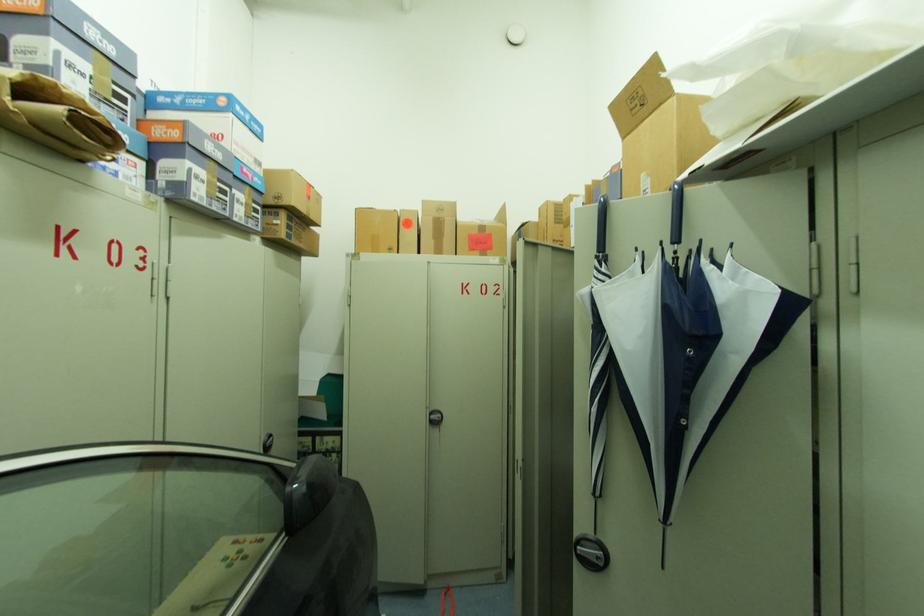
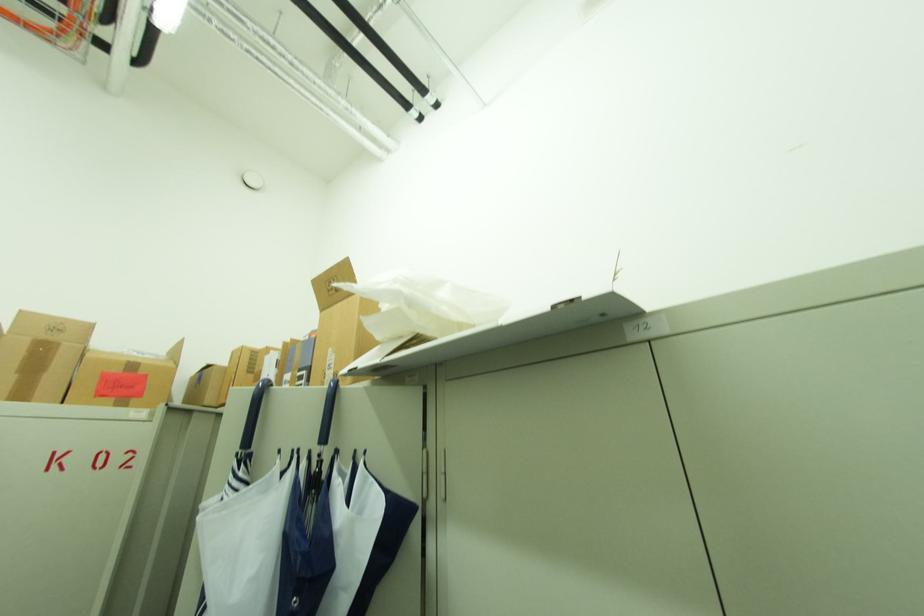
How did the camera likely rotate?

The camera rotated toward right-up.